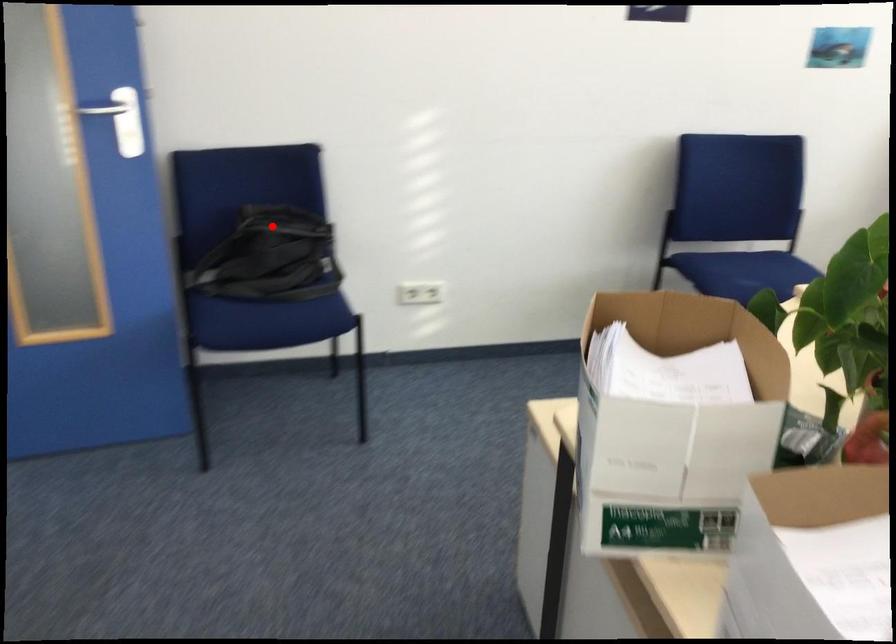
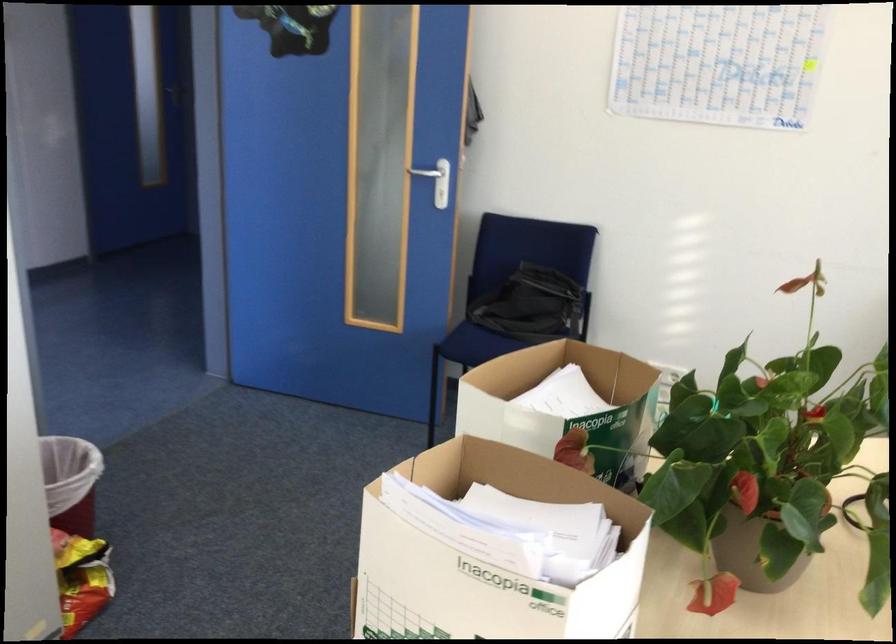
In the second image, find the point that corresponds to the highlighted location in the first image.

(515, 275)